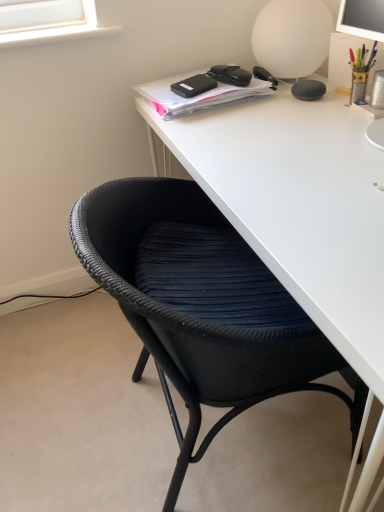
Question: Considering the positions of white matte table lamp at upper right and black matte glasses at upper center, acting as the third stationery starting from the right, in the image, is white matte table lamp at upper right bigger or smaller than black matte glasses at upper center, acting as the third stationery starting from the right,?

Choices:
 (A) small
 (B) big

Answer: (B)

Question: Is point (317, 19) positioned closer to the camera than point (210, 73)?

Choices:
 (A) closer
 (B) farther

Answer: (A)

Question: Estimate the real-world distances between objects in this image. Which object is farther from the black matte hard drive at upper center, placed as the first stationery when sorted from left to right?

Choices:
 (A) black matte glasses at upper center, acting as the third stationery starting from the right
 (B) white matte table lamp at upper right
 (C) black matte notebook at upper center
 (D) white matte desk at center
 (E) matte black speaker at upper right, placed as the 3th stationery when sorted from left to right

Answer: (D)

Question: Estimate the real-world distances between objects in this image. Which object is closer to the white matte desk at center?

Choices:
 (A) black matte notebook at upper center
 (B) black woven chair at lower left
 (C) matte black speaker at upper right, placed as the 3th stationery when sorted from left to right
 (D) white matte table lamp at upper right
 (E) black matte glasses at upper center, acting as the third stationery starting from the right

Answer: (B)